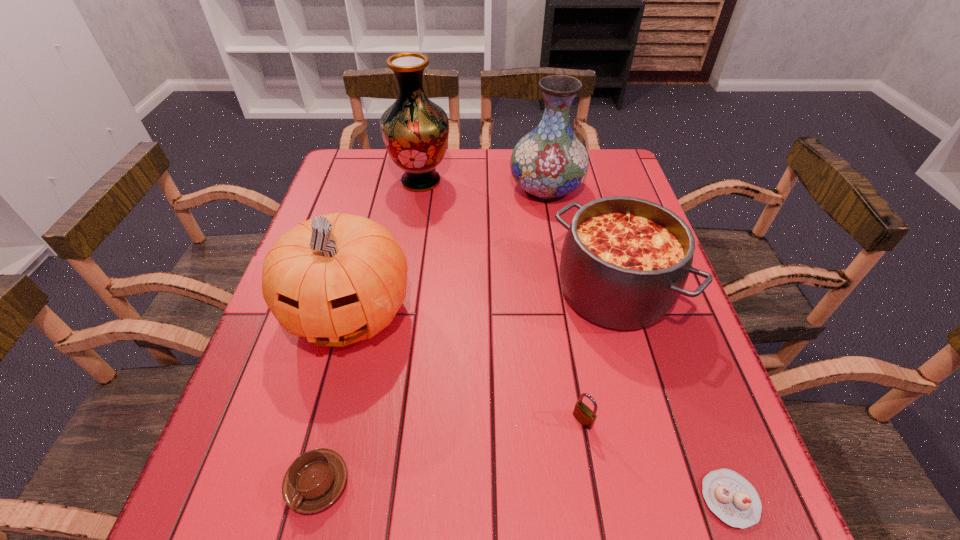
You are a GUI agent. You are given a task and a screenshot of the screen. Output one action in this format:
    pyautogui.click(x=<x>, y=<y>)
    Task: Click on the vacant space located 0.250m on the front-facing side of the pumpkin
    
    Given the screenshot: What is the action you would take?
    pyautogui.click(x=299, y=503)

Locate an element on the screen. This screenshot has width=960, height=540. vacant space located 0.090m on the front of the casserole is located at coordinates (638, 381).

This screenshot has width=960, height=540. Find the location of `free space located on the right of the third shortest object`. free space located on the right of the third shortest object is located at coordinates tap(669, 421).

Locate an element on the screen. Image resolution: width=960 pixels, height=540 pixels. free spot located on the left of the cupcake is located at coordinates (608, 499).

This screenshot has width=960, height=540. In order to click on cappuccino that is at the near edge in this screenshot , I will do `click(315, 479)`.

Identify the location of cupcake at the near edge. (731, 497).

I want to click on pumpkin at the left edge, so click(x=336, y=279).

Locate an element on the screen. cappuccino that is at the left edge is located at coordinates (315, 479).

At what (x,y) coordinates should I click in order to perform the action: click on vase that is at the right edge. Please return your answer as a coordinate pair (x, y). The height and width of the screenshot is (540, 960). Looking at the image, I should click on (549, 162).

The height and width of the screenshot is (540, 960). In order to click on casserole at the right edge in this screenshot , I will do `click(624, 263)`.